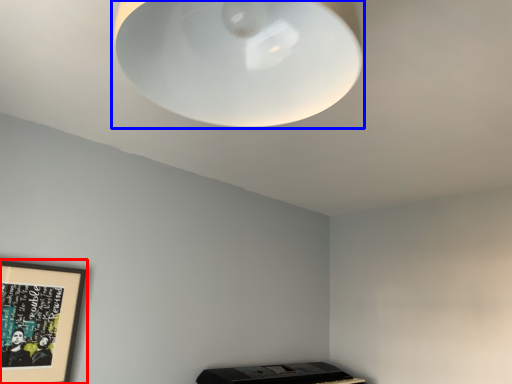
Question: Among these objects, which one is nearest to the camera, picture frame (highlighted by a red box) or lamp (highlighted by a blue box)?

Choices:
 (A) picture frame
 (B) lamp

Answer: (B)